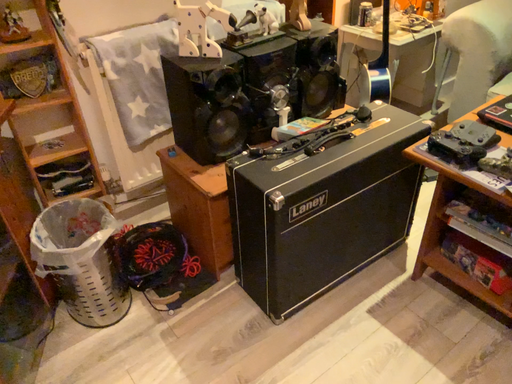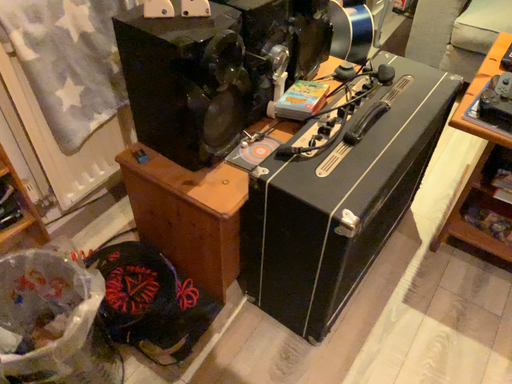
Question: Which way did the camera rotate in the video?

Choices:
 (A) rotated upward
 (B) rotated downward

Answer: (B)